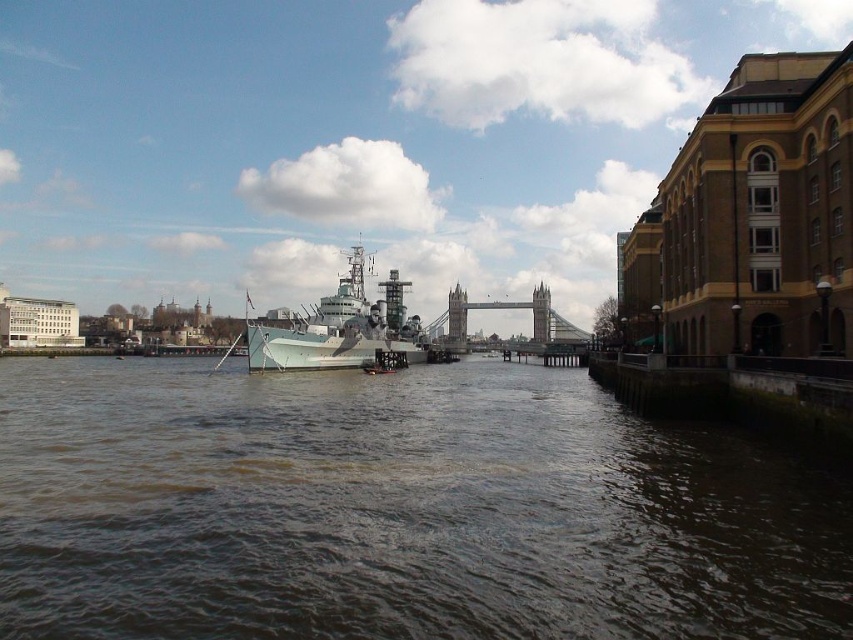
Question: Which point is farther from the camera taking this photo?

Choices:
 (A) (251, 364)
 (B) (456, 339)

Answer: (B)

Question: Which object appears closest to the camera in this image?

Choices:
 (A) brown murky water at center
 (B) stone gray bridge at center
 (C) gray metallic battleship at center

Answer: (A)

Question: Is brown murky water at center behind stone gray bridge at center?

Choices:
 (A) yes
 (B) no

Answer: (B)

Question: Which object is the closest to the stone gray bridge at center?

Choices:
 (A) brown murky water at center
 (B) gray metallic battleship at center

Answer: (B)

Question: Can you confirm if brown murky water at center is smaller than stone gray bridge at center?

Choices:
 (A) no
 (B) yes

Answer: (B)

Question: Is brown murky water at center positioned in front of gray metallic battleship at center?

Choices:
 (A) no
 (B) yes

Answer: (B)